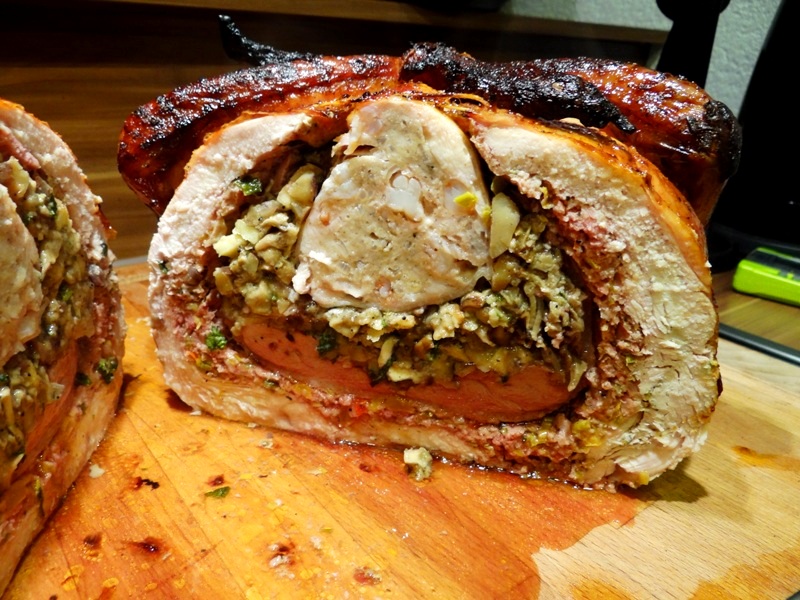
Identify the location of dry part of wooden surface. (738, 506).